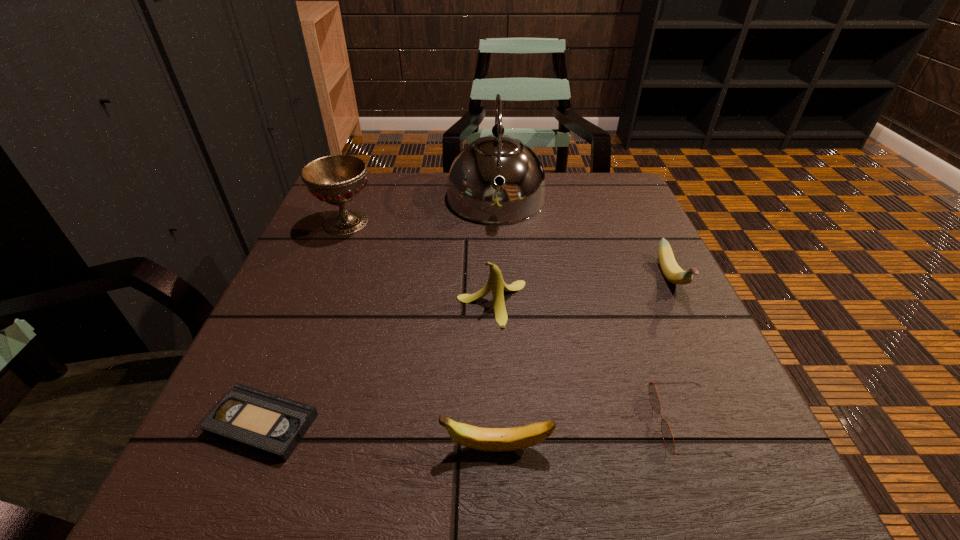
I want to click on chalice present at the far edge, so click(x=338, y=179).

Find the location of a particular element. This screenshot has width=960, height=540. banana that is at the near edge is located at coordinates (484, 439).

This screenshot has width=960, height=540. Find the location of `sunglasses that is at the near edge`. sunglasses that is at the near edge is located at coordinates (667, 435).

The height and width of the screenshot is (540, 960). What are the coordinates of `videotape that is at the near edge` in the screenshot? It's located at (271, 425).

Find the location of a particular element. The width and height of the screenshot is (960, 540). chalice located at the left edge is located at coordinates (338, 179).

I want to click on videotape that is at the left edge, so click(x=271, y=425).

Locate an element on the screen. The image size is (960, 540). banana positioned at the right edge is located at coordinates (671, 270).

This screenshot has height=540, width=960. What are the coordinates of `sunglasses that is at the right edge` in the screenshot? It's located at (667, 435).

The height and width of the screenshot is (540, 960). Find the location of `object at the far left corner`. object at the far left corner is located at coordinates (338, 179).

The width and height of the screenshot is (960, 540). I want to click on object present at the near left corner, so click(x=271, y=425).